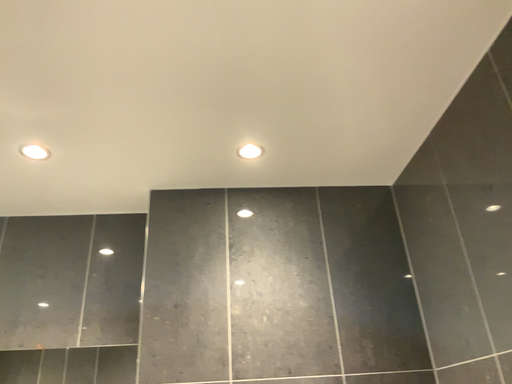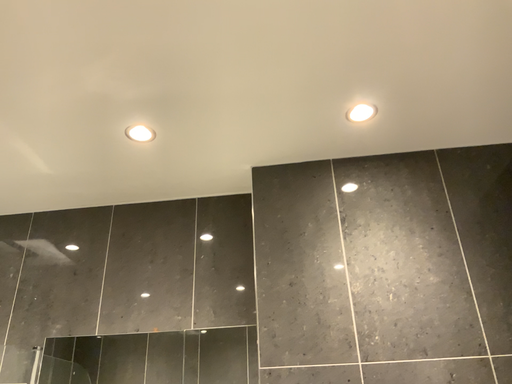
Question: Which way did the camera rotate in the video?

Choices:
 (A) rotated left
 (B) rotated right

Answer: (A)